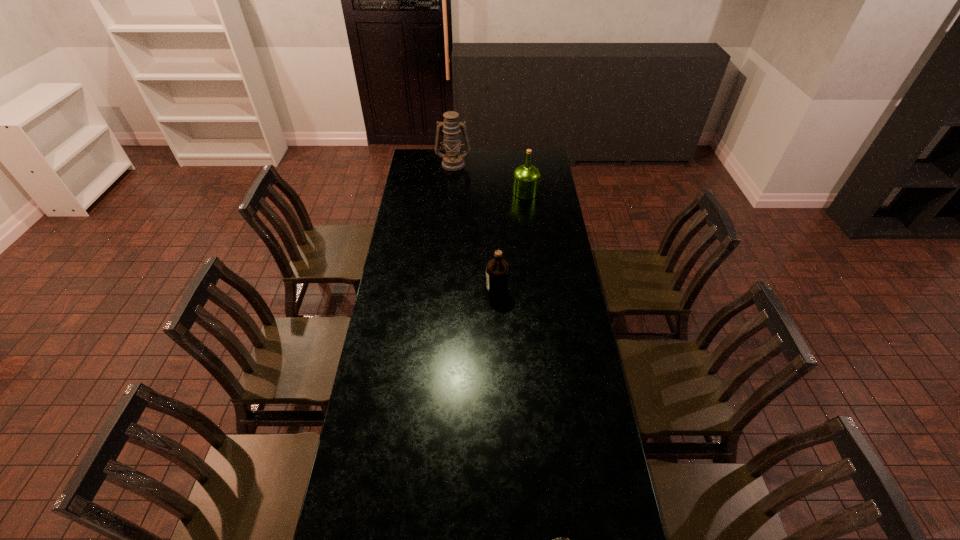
This screenshot has height=540, width=960. Identify the location of the leftmost object. (452, 160).

The height and width of the screenshot is (540, 960). Find the location of `oil lamp`. oil lamp is located at coordinates (452, 160).

Image resolution: width=960 pixels, height=540 pixels. What are the coordinates of `the farther olive oil` in the screenshot? It's located at (526, 178).

Find the location of `the third nearest object`. the third nearest object is located at coordinates click(526, 178).

Find the location of a particular element. the nearer olive oil is located at coordinates (497, 269).

This screenshot has height=540, width=960. Find the location of `the second nearest object`. the second nearest object is located at coordinates point(497,269).

Find the location of a particular element. The width and height of the screenshot is (960, 540). free space located 0.230m on the right of the tallest object is located at coordinates (510, 164).

The width and height of the screenshot is (960, 540). What are the coordinates of `vacant point located 0.280m on the front of the right olive oil` in the screenshot? It's located at (531, 234).

Locate an element on the screen. Image resolution: width=960 pixels, height=540 pixels. blank area located 0.070m on the label of the third farthest object is located at coordinates [x=469, y=292].

The width and height of the screenshot is (960, 540). Identify the location of vacant point located 0.160m on the label of the third farthest object. (448, 292).